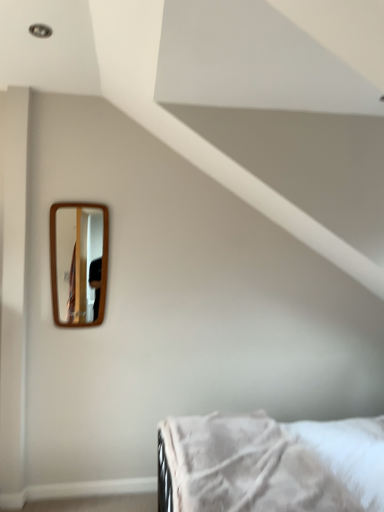
Question: From a real-world perspective, is white soft fabric bed at lower right physically located above or below wooden-framed mirror at upper left?

Choices:
 (A) below
 (B) above

Answer: (A)

Question: Is point (332, 449) positioned closer to the camera than point (91, 224)?

Choices:
 (A) farther
 (B) closer

Answer: (B)

Question: Is white soft fabric bed at lower right wider or thinner than wooden-framed mirror at upper left?

Choices:
 (A) thin
 (B) wide

Answer: (B)

Question: Looking at the image, does wooden-framed mirror at upper left seem bigger or smaller compared to white soft fabric bed at lower right?

Choices:
 (A) big
 (B) small

Answer: (B)

Question: From a real-world perspective, is wooden-framed mirror at upper left above or below white soft fabric bed at lower right?

Choices:
 (A) above
 (B) below

Answer: (A)

Question: Does point (84, 260) appear closer or farther from the camera than point (240, 420)?

Choices:
 (A) farther
 (B) closer

Answer: (A)

Question: In the image, is wooden-framed mirror at upper left positioned in front of or behind white soft fabric bed at lower right?

Choices:
 (A) front
 (B) behind

Answer: (B)